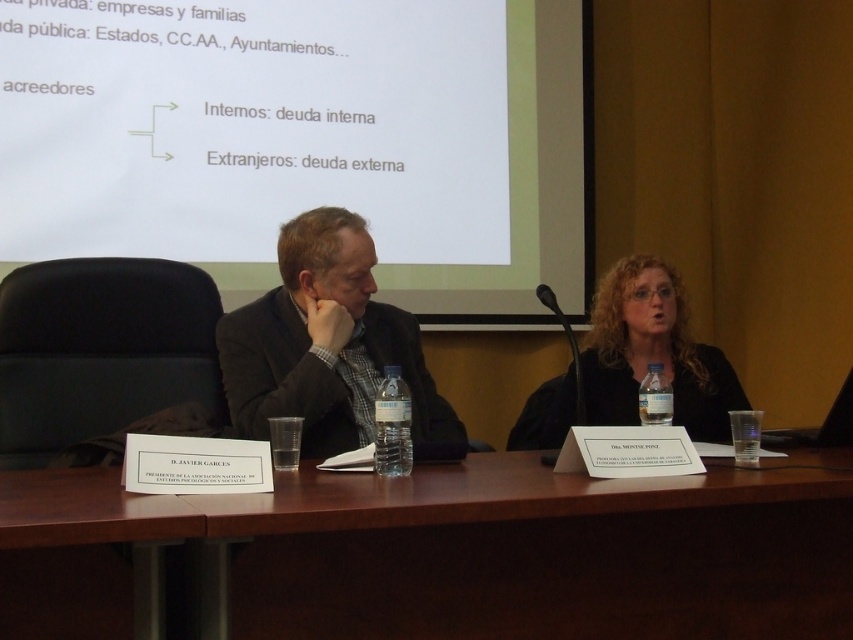
Is white matte projector screen at upper center further to camera compared to matte black jacket at center?

That is True.

This screenshot has width=853, height=640. I want to click on white matte projector screen at upper center, so click(300, 138).

Is white matte projector screen at upper center closer to the viewer compared to brown wood table at center?

No, white matte projector screen at upper center is further to the viewer.

Does white matte projector screen at upper center have a lesser width compared to brown wood table at center?

No.

The width and height of the screenshot is (853, 640). Find the location of `white matte projector screen at upper center`. white matte projector screen at upper center is located at coordinates (300, 138).

Is point (399, 314) closer to camera compared to point (616, 320)?

Yes.

What do you see at coordinates (326, 346) in the screenshot? Image resolution: width=853 pixels, height=640 pixels. I see `matte black suit at center` at bounding box center [326, 346].

I want to click on matte black suit at center, so click(326, 346).